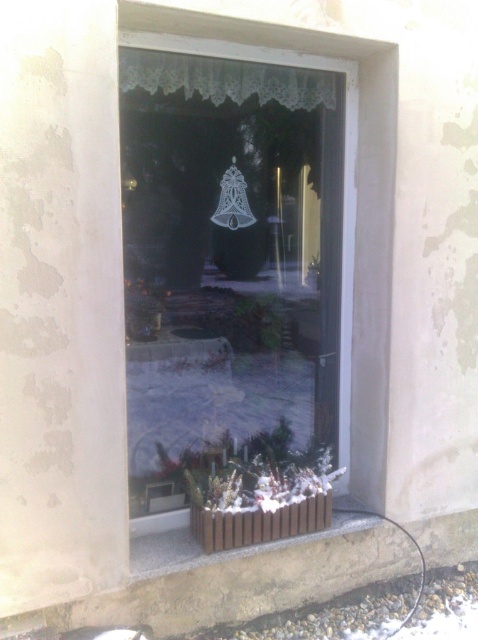
You are an interior designer planning to hang a new picture frame between the transparent glass bell at center and the white lace curtain at upper center. Based on their positions, which object should the frame be placed closer to?

The transparent glass bell at center is positioned on the left side of the white lace curtain at upper center, so the frame should be placed closer to the transparent glass bell at center to maintain symmetry between the two objects.

You are an interior designer planning to place a new decorative item in the space between the transparent glass bell at center and the brown wooden curb at lower center. The item must fit snugly without being too bulky. Based on their sizes, which object should the new item be compared to in terms of width to ensure it fits?

The transparent glass bell at center is thinner than the brown wooden curb at lower center, so the new item should be compared to the transparent glass bell at center in terms of width to ensure it is not too bulky and fits snugly between them.

You are an interior designer assessing the placement of the transparent glass bell at center and the white lace curtain at upper center in the window. Based on their positions, which object is closer to the top edge of the window frame?

The white lace curtain at upper center is closer to the top edge of the window frame since it is positioned above the transparent glass bell at center.